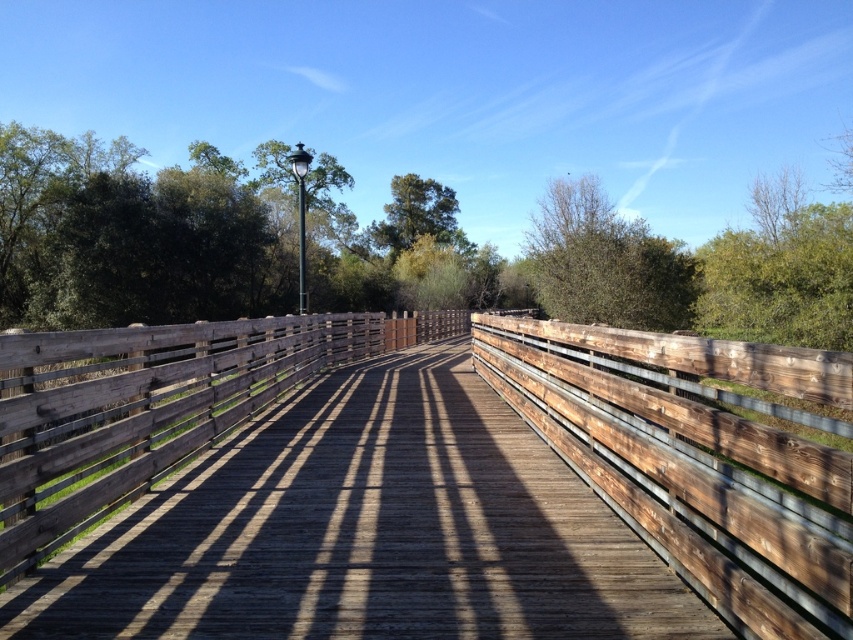
Is green leafy tree at center smaller than green matte tree at center?

Actually, green leafy tree at center might be larger than green matte tree at center.

Is green leafy tree at center below green matte tree at center?

Yes.

Is point (567, 243) closer to viewer compared to point (404, 250)?

Yes, it is in front of point (404, 250).

Locate an element on the screen. green leafy tree at center is located at coordinates (606, 266).

Does point (473, 547) come closer to viewer compared to point (375, 240)?

Yes, point (473, 547) is in front of point (375, 240).

Is weathered wood bridge at center taller than green matte tree at center?

No.

Between point (619, 561) and point (438, 228), which one is positioned in front?

Positioned in front is point (619, 561).

Where is `weathered wood bridge at center`? Image resolution: width=853 pixels, height=640 pixels. weathered wood bridge at center is located at coordinates pos(366,531).

Which is behind, point (378, 417) or point (26, 285)?

Point (26, 285)

Does point (361, 417) come closer to viewer compared to point (453, 307)?

Yes, point (361, 417) is closer to viewer.

Is point (585, 486) farther from viewer compared to point (752, 244)?

No.

Locate an element on the screen. The width and height of the screenshot is (853, 640). weathered wood bridge at center is located at coordinates (366, 531).